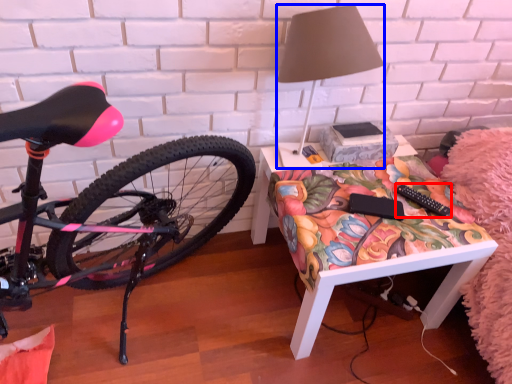
Question: Which of the following is the closest to the observer, remote control (highlighted by a red box) or lamp (highlighted by a blue box)?

Choices:
 (A) remote control
 (B) lamp

Answer: (B)